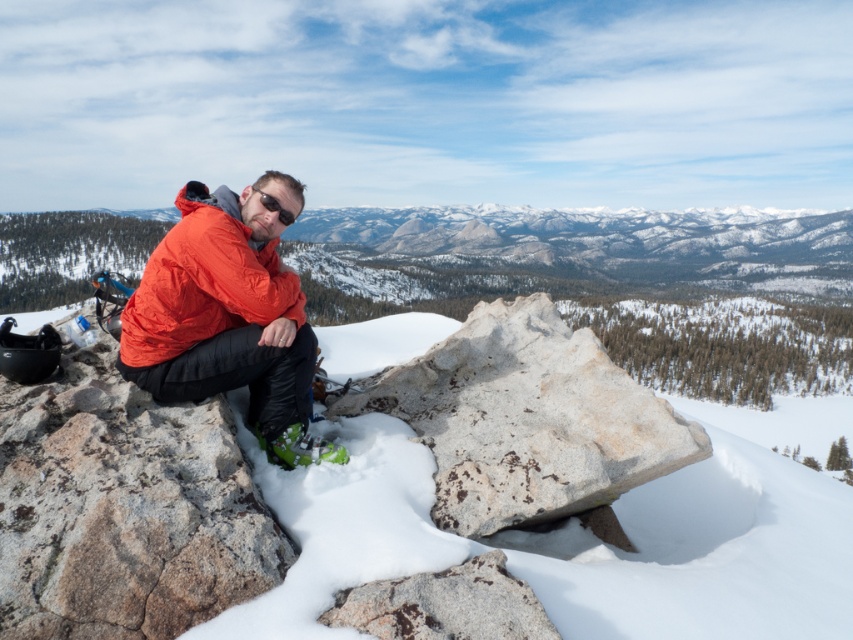
Question: In this image, where is white powdery snow at center located relative to granite rock at left?

Choices:
 (A) below
 (B) above

Answer: (A)

Question: Is matte orange jacket at center below black matte sunglasses at center?

Choices:
 (A) yes
 (B) no

Answer: (A)

Question: Which point is farther from the camera taking this photo?

Choices:
 (A) (549, 483)
 (B) (421, 630)
 (C) (16, 611)

Answer: (A)

Question: Does smooth granite boulder at center appear over granite boulder at center?

Choices:
 (A) yes
 (B) no

Answer: (A)

Question: Which point is closer to the camera?

Choices:
 (A) (596, 376)
 (B) (184, 634)
 (C) (167, 312)

Answer: (B)

Question: Among these objects, which one is farthest from the camera?

Choices:
 (A) granite boulder at center
 (B) matte orange jacket at center
 (C) smooth granite boulder at center
 (D) gray speckled rock at center

Answer: (C)